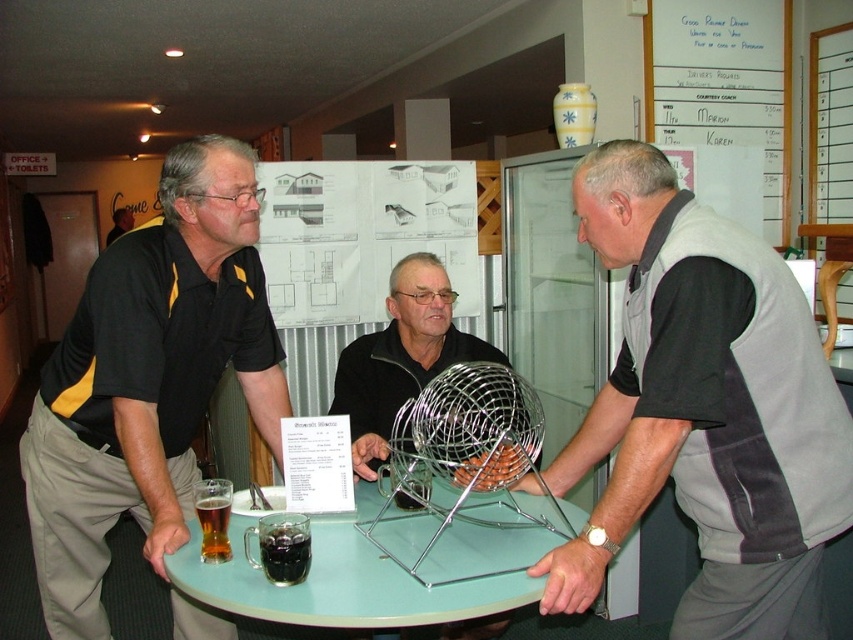
Question: Is white paperboard at upper right above translucent glass table at center?

Choices:
 (A) no
 (B) yes

Answer: (B)

Question: Among these points, which one is nearest to the camera?

Choices:
 (A) (824, 417)
 (B) (483, 612)

Answer: (B)

Question: Which object is closer to the camera taking this photo?

Choices:
 (A) translucent glass table at center
 (B) black jersey at left
 (C) metallic wire ball at center

Answer: (A)

Question: Can you confirm if gray fabric vest at center is positioned to the right of metallic wire ball at center?

Choices:
 (A) yes
 (B) no

Answer: (A)

Question: Which of the following is the farthest from the observer?

Choices:
 (A) metallic wire ball at center
 (B) white paperboard at upper right

Answer: (B)

Question: Is black jersey at left in front of translucent glass mug at lower left?

Choices:
 (A) yes
 (B) no

Answer: (B)